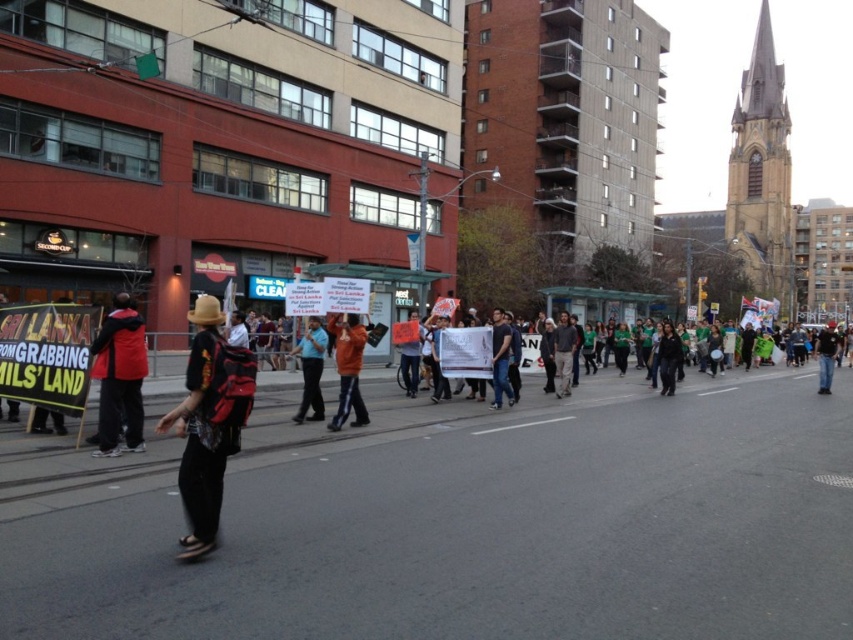
You are standing at the camera position in the protest scene. There is a point at coordinates point (192, 444). Can you tell me how far this point is from your current position?

The point (192, 444) is 5.39 meters away from the camera position.

You are a delivery person who needs to place both the matte black backpack at center and the orange fabric sign at center into a storage locker. The locker has a maximum capacity of 0.5 cubic meters. Knowing their sizes, can both items fit inside the locker together?

The matte black backpack at center is larger than the orange fabric sign at center. However, without specific size measurements, it is impossible to determine if both items can fit into the locker with a 0.5 cubic meter capacity. More information about their individual volumes is needed.